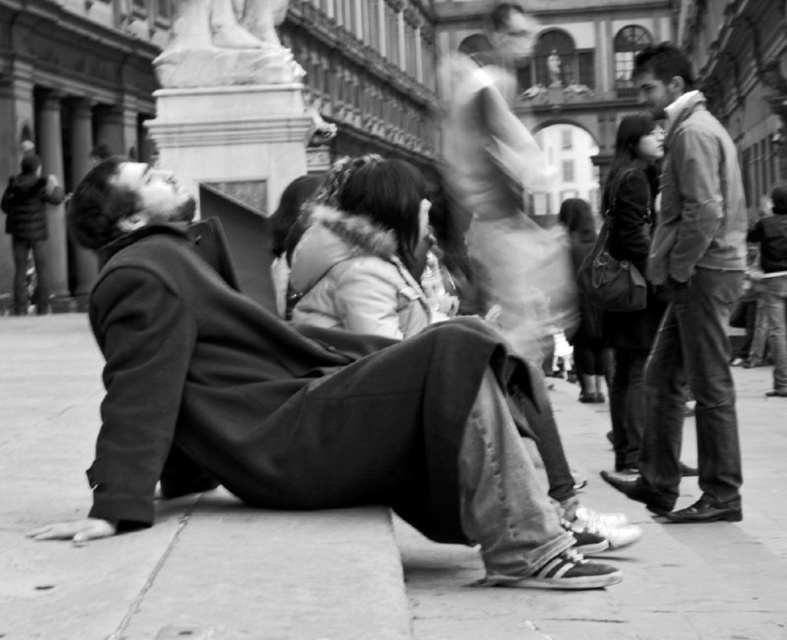
Question: Is matte black coat at lower left above leather jacket at right?

Choices:
 (A) yes
 (B) no

Answer: (B)

Question: Considering the real-world distances, which object is farthest from the white marble statue at upper center?

Choices:
 (A) smooth concrete pavement at lower center
 (B) white fur-lined coat at center
 (C) leather jacket at right
 (D) smooth leather bag at center

Answer: (C)

Question: Which object is positioned closest to the leather jacket at right?

Choices:
 (A) matte black coat at lower left
 (B) white fur-lined coat at center
 (C) smooth concrete pavement at lower center
 (D) translucent white robe at center

Answer: (B)

Question: Does matte black coat at lower left have a lesser width compared to leather jacket at right?

Choices:
 (A) no
 (B) yes

Answer: (B)

Question: Does translucent white robe at center appear on the right side of smooth leather bag at center?

Choices:
 (A) yes
 (B) no

Answer: (A)

Question: Which object is farther from the camera taking this photo?

Choices:
 (A) smooth leather bag at center
 (B) matte black jacket at right
 (C) white fur-lined coat at center
 (D) leather jacket at right

Answer: (A)